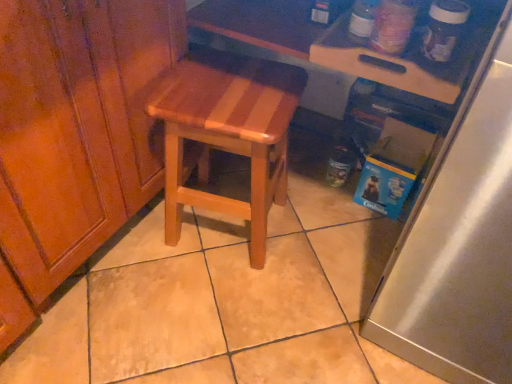
At what (x,y) coordinates should I click in order to perform the action: click on wooden at center. Please return your answer as a coordinate pair (x, y). The image size is (512, 384). Looking at the image, I should click on (228, 133).

Looking at this image, from a real-world perspective, does wooden at center stand above wooden cutting board at upper right?

Incorrect, from a real-world perspective, wooden at center is lower than wooden cutting board at upper right.

Can you confirm if wooden at center is shorter than wooden cutting board at upper right?

No.

Does wooden at center touch wooden cutting board at upper right?

wooden at center and wooden cutting board at upper right are clearly separated.

Does wooden at center appear on the left side of wooden cutting board at upper right?

Indeed, wooden at center is positioned on the left side of wooden cutting board at upper right.

Does point (270, 48) come in front of point (475, 372)?

No, it is not.

Are wooden cutting board at upper right and satin silver refrigerator at right far apart?

wooden cutting board at upper right is near satin silver refrigerator at right, not far away.

From the image's perspective, which one is positioned higher, wooden cutting board at upper right or satin silver refrigerator at right?

wooden cutting board at upper right, from the image's perspective.

How many degrees apart are the facing directions of wooden at center and satin silver refrigerator at right?

The angle between the facing direction of wooden at center and the facing direction of satin silver refrigerator at right is 170 degrees.

Is point (230, 207) closer or farther from the camera than point (400, 236)?

Point (230, 207) is farther from the camera than point (400, 236).

From a real-world perspective, is wooden at center above or below satin silver refrigerator at right?

Clearly, from a real-world perspective, wooden at center is below satin silver refrigerator at right.

From the image's perspective, is wooden at center positioned above or below satin silver refrigerator at right?

wooden at center is situated higher than satin silver refrigerator at right in the image.

Which object is positioned more to the left, wooden cutting board at upper right or wooden at center?

Positioned to the left is wooden at center.

In the scene shown: Considering the sizes of objects wooden cutting board at upper right and wooden at center in the image provided, who is wider, wooden cutting board at upper right or wooden at center?

With larger width is wooden cutting board at upper right.

Looking at this image, is wooden cutting board at upper right far away from wooden at center?

No, there isn't a large distance between wooden cutting board at upper right and wooden at center.

Is wooden cutting board at upper right positioned with its back to wooden at center?

wooden cutting board at upper right does not have its back to wooden at center.

Visually, is satin silver refrigerator at right positioned to the left or to the right of wooden cutting board at upper right?

Based on their positions, satin silver refrigerator at right is located to the right of wooden cutting board at upper right.

Which point is more distant from viewer, (472, 362) or (284, 18)?

The point (284, 18) is farther from the camera.

Is satin silver refrigerator at right positioned in front of wooden cutting board at upper right?

Yes, the depth of satin silver refrigerator at right is less than that of wooden cutting board at upper right.

Image resolution: width=512 pixels, height=384 pixels. I want to click on appliance below the wooden cutting board at upper right (from the image's perspective), so click(x=459, y=242).

Does point (448, 346) lie behind point (179, 157)?

That is False.

Which is more to the right, satin silver refrigerator at right or wooden at center?

Positioned to the right is satin silver refrigerator at right.

From the image's perspective, which is above, satin silver refrigerator at right or wooden at center?

wooden at center appears higher in the image.

From a real-world perspective, who is located higher, satin silver refrigerator at right or wooden at center?

satin silver refrigerator at right.

At what (x,y) coordinates should I click in order to perform the action: click on stool below the wooden cutting board at upper right (from a real-world perspective). Please return your answer as a coordinate pair (x, y). Image resolution: width=512 pixels, height=384 pixels. Looking at the image, I should click on (228, 133).

Find the location of `table above the satin silver refrigerator at right (from a real-world perspective)`. table above the satin silver refrigerator at right (from a real-world perspective) is located at coordinates (329, 45).

Which object lies nearer to the anchor point satin silver refrigerator at right, wooden cutting board at upper right or wooden at center?

wooden cutting board at upper right.

Consider the image. Considering their positions, is satin silver refrigerator at right positioned further to wooden at center than wooden cutting board at upper right?

satin silver refrigerator at right.

When comparing their distances from wooden cutting board at upper right, does wooden at center or satin silver refrigerator at right seem closer?

The object closer to wooden cutting board at upper right is wooden at center.

From the image, which object appears to be nearer to wooden at center, wooden cutting board at upper right or satin silver refrigerator at right?

wooden cutting board at upper right.

From the image, which object appears to be farther from satin silver refrigerator at right, wooden at center or wooden cutting board at upper right?

wooden at center lies further to satin silver refrigerator at right than the other object.

From the image, which object appears to be farther from wooden cutting board at upper right, satin silver refrigerator at right or wooden at center?

satin silver refrigerator at right.

The image size is (512, 384). I want to click on table situated between wooden at center and satin silver refrigerator at right from left to right, so click(x=329, y=45).